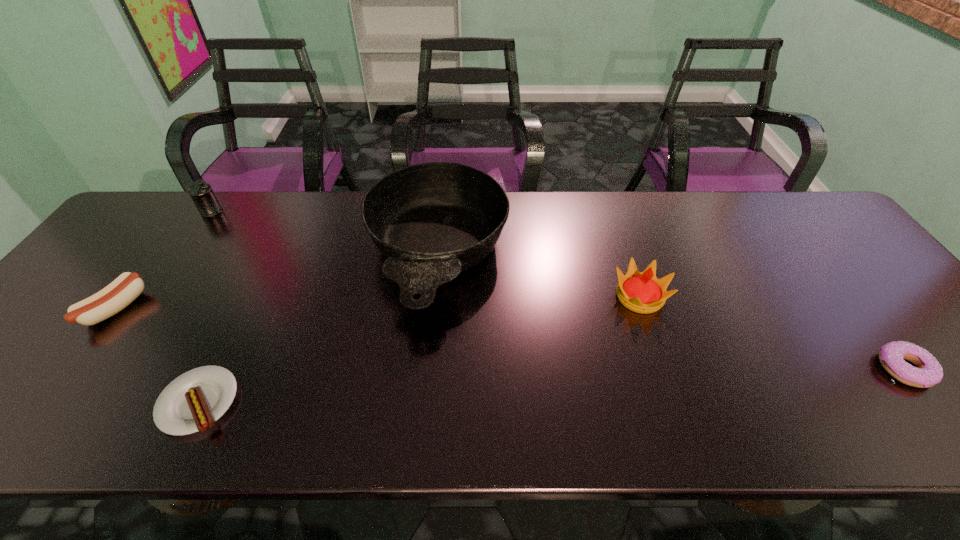
In order to click on the fourth object from left to right in this screenshot , I will do tap(431, 221).

The height and width of the screenshot is (540, 960). I want to click on frying pan, so click(x=431, y=221).

Identify the location of crown. This screenshot has width=960, height=540. (641, 292).

The image size is (960, 540). Identify the location of can. (201, 193).

Where is `the farther sausage`? The image size is (960, 540). the farther sausage is located at coordinates (116, 296).

At what (x,y) coordinates should I click in order to perform the action: click on the left sausage. Please return your answer as a coordinate pair (x, y). The height and width of the screenshot is (540, 960). Looking at the image, I should click on (116, 296).

The height and width of the screenshot is (540, 960). Find the location of `the rightmost object`. the rightmost object is located at coordinates tap(928, 372).

Where is `the third object from left to right`? the third object from left to right is located at coordinates (194, 401).

This screenshot has width=960, height=540. Find the location of `the shorter sausage`. the shorter sausage is located at coordinates (194, 401).

Image resolution: width=960 pixels, height=540 pixels. I want to click on vacant space located with the handle extending from the side of the tallest object, so click(421, 414).